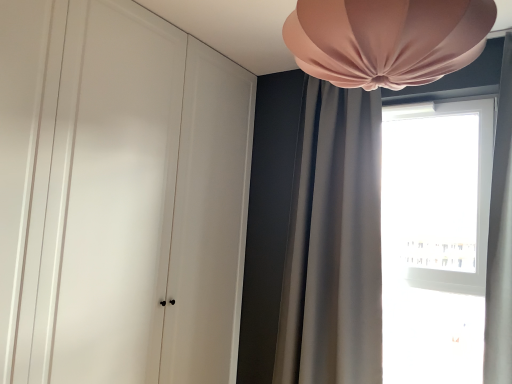
Where is `pink fabric lampshade at upper center`? The height and width of the screenshot is (384, 512). pink fabric lampshade at upper center is located at coordinates (387, 39).

What do you see at coordinates (387, 39) in the screenshot? This screenshot has width=512, height=384. I see `pink fabric lampshade at upper center` at bounding box center [387, 39].

Image resolution: width=512 pixels, height=384 pixels. Find the location of `pink fabric lampshade at upper center`. pink fabric lampshade at upper center is located at coordinates (387, 39).

Which of these two, transparent glass window at right or matte white wardrobe at left, is bigger?

With larger size is matte white wardrobe at left.

Considering the points (447, 237) and (112, 271), which point is behind, point (447, 237) or point (112, 271)?

The point (447, 237) is more distant.

Which object is thinner, transparent glass window at right or matte white wardrobe at left?

With smaller width is transparent glass window at right.

Is transparent glass window at right completely or partially outside of matte white wardrobe at left?

Yes.

Looking at this image, do you think pink fabric lampshade at upper center is within matte white wardrobe at left, or outside of it?

The correct answer is: outside.

Is pink fabric lampshade at upper center aimed at matte white wardrobe at left?

No, pink fabric lampshade at upper center is not facing towards matte white wardrobe at left.

Is pink fabric lampshade at upper center at the left side of matte white wardrobe at left?

In fact, pink fabric lampshade at upper center is to the right of matte white wardrobe at left.

Is pink fabric lampshade at upper center not near matte white wardrobe at left?

Absolutely, pink fabric lampshade at upper center is distant from matte white wardrobe at left.

Is satin gray curtain at upper right positioned far away from matte white wardrobe at left?

satin gray curtain at upper right is actually quite close to matte white wardrobe at left.

Locate an element on the screen. curtain below the matte white wardrobe at left (from the image's perspective) is located at coordinates (334, 243).

From the image's perspective, is satin gray curtain at upper right on top of matte white wardrobe at left?

No, from the image's perspective, satin gray curtain at upper right is not on top of matte white wardrobe at left.

From a real-world perspective, is satin gray curtain at upper right above or below matte white wardrobe at left?

satin gray curtain at upper right is situated higher than matte white wardrobe at left in the real world.

Who is bigger, transparent glass window at right or satin gray curtain at upper right?

satin gray curtain at upper right.

Can you tell me how much transparent glass window at right and satin gray curtain at upper right differ in facing direction?

0.178 degrees.

Where is `window that is under the satin gray curtain at upper right (from a real-world perspective)`? window that is under the satin gray curtain at upper right (from a real-world perspective) is located at coordinates (435, 239).

Does transparent glass window at right have a lesser height compared to satin gray curtain at upper right?

Indeed, transparent glass window at right has a lesser height compared to satin gray curtain at upper right.

What's the angular difference between satin gray curtain at upper right and transparent glass window at right's facing directions?

The angle between the facing direction of satin gray curtain at upper right and the facing direction of transparent glass window at right is 0.178 degrees.

From a real-world perspective, is satin gray curtain at upper right physically located above or below transparent glass window at right?

In terms of real-world spatial position, satin gray curtain at upper right is above transparent glass window at right.

Is satin gray curtain at upper right oriented away from transparent glass window at right?

No, satin gray curtain at upper right is not facing the opposite direction of transparent glass window at right.

Identify the location of window behind the satin gray curtain at upper right. The height and width of the screenshot is (384, 512). (435, 239).

Which point is more forward, (424, 259) or (425, 37)?

Positioned in front is point (425, 37).

Considering the relative positions of transparent glass window at right and pink fabric lampshade at upper center in the image provided, is transparent glass window at right to the right of pink fabric lampshade at upper center from the viewer's perspective?

Indeed, transparent glass window at right is positioned on the right side of pink fabric lampshade at upper center.

How much distance is there between transparent glass window at right and pink fabric lampshade at upper center?

transparent glass window at right and pink fabric lampshade at upper center are 5.30 feet apart from each other.

Image resolution: width=512 pixels, height=384 pixels. What are the coordinates of `window behind the pink fabric lampshade at upper center` in the screenshot? It's located at (435, 239).

Locate an element on the screen. The image size is (512, 384). dresser that appears on the left of pink fabric lampshade at upper center is located at coordinates (119, 197).

Do you think matte white wardrobe at left is within pink fabric lampshade at upper center, or outside of it?

matte white wardrobe at left is located beyond the bounds of pink fabric lampshade at upper center.

Which point is more forward, [76,218] or [370,24]?

The point [370,24] is closer to the camera.

Can you confirm if matte white wardrobe at left is thinner than pink fabric lampshade at upper center?

Yes.

Identify the location of dresser on the left of transparent glass window at right. (119, 197).

Find the location of `lamp that appears on the right of matte white wardrobe at left`. lamp that appears on the right of matte white wardrobe at left is located at coordinates (387, 39).

Looking at the image, which one is located further to transparent glass window at right, satin gray curtain at upper right or matte white wardrobe at left?

matte white wardrobe at left.

When comparing their distances from satin gray curtain at upper right, does transparent glass window at right or pink fabric lampshade at upper center seem further?

The object further to satin gray curtain at upper right is pink fabric lampshade at upper center.

From the image, which object appears to be nearer to transparent glass window at right, matte white wardrobe at left or pink fabric lampshade at upper center?

matte white wardrobe at left lies closer to transparent glass window at right than the other object.

Looking at the image, which one is located closer to matte white wardrobe at left, pink fabric lampshade at upper center or satin gray curtain at upper right?

satin gray curtain at upper right.

From the image, which object appears to be nearer to satin gray curtain at upper right, pink fabric lampshade at upper center or transparent glass window at right?

Based on the image, transparent glass window at right appears to be nearer to satin gray curtain at upper right.

From the image, which object appears to be farther from matte white wardrobe at left, transparent glass window at right or satin gray curtain at upper right?

Among the two, transparent glass window at right is located further to matte white wardrobe at left.

Which object lies further to the anchor point pink fabric lampshade at upper center, transparent glass window at right or matte white wardrobe at left?

transparent glass window at right.

Based on their spatial positions, is satin gray curtain at upper right or transparent glass window at right further from pink fabric lampshade at upper center?

transparent glass window at right is positioned further to the anchor pink fabric lampshade at upper center.

At what (x,y) coordinates should I click in order to perform the action: click on dresser positioned between pink fabric lampshade at upper center and satin gray curtain at upper right from near to far. Please return your answer as a coordinate pair (x, y). The width and height of the screenshot is (512, 384). Looking at the image, I should click on (119, 197).

You are a GUI agent. You are given a task and a screenshot of the screen. Output one action in this format:
    pyautogui.click(x=<x>, y=<y>)
    Task: Click on the curtain between matte white wardrobe at left and transparent glass window at right
    The height and width of the screenshot is (384, 512).
    Given the screenshot: What is the action you would take?
    pyautogui.click(x=334, y=243)

The height and width of the screenshot is (384, 512). What are the coordinates of `curtain between pink fabric lampshade at upper center and transparent glass window at right along the z-axis` in the screenshot? It's located at (334, 243).

What are the coordinates of `lamp located between matte white wardrobe at left and transparent glass window at right in the left-right direction` in the screenshot? It's located at click(387, 39).